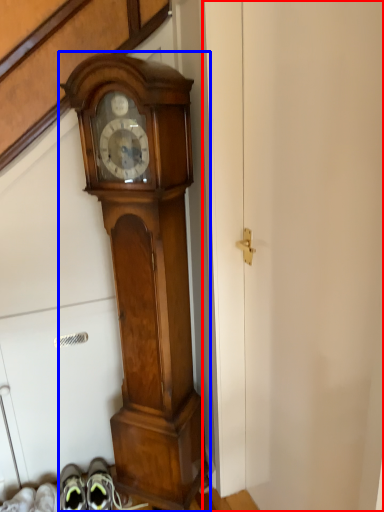
Question: Which object is closer to the camera taking this photo, door (highlighted by a red box) or wall clock (highlighted by a blue box)?

Choices:
 (A) door
 (B) wall clock

Answer: (A)